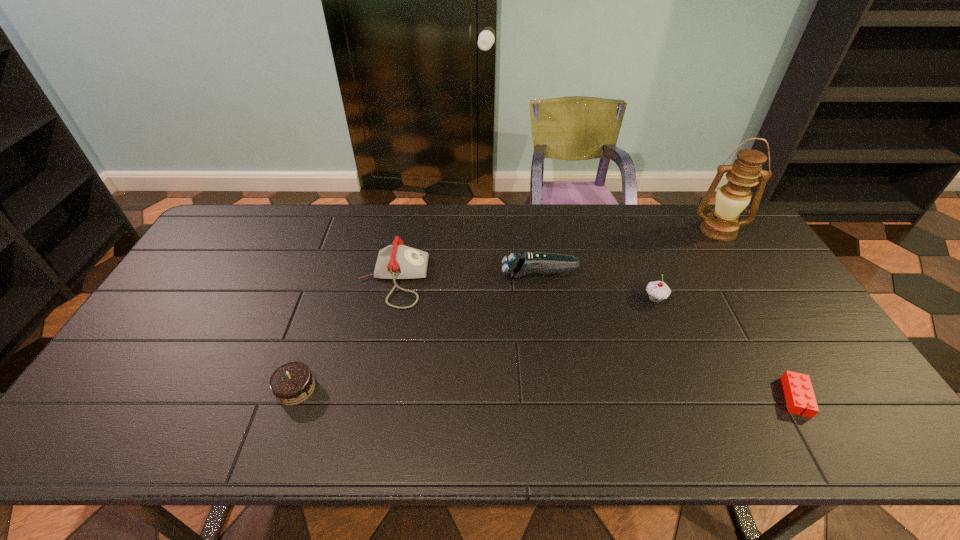
The image size is (960, 540). Identify the location of object that is at the far right corner. (731, 199).

At what (x,y) coordinates should I click in order to perform the action: click on object that is at the near right corner. Please return your answer as a coordinate pair (x, y). This screenshot has width=960, height=540. Looking at the image, I should click on (798, 390).

Where is `free spot at the far edge of the desktop`? Image resolution: width=960 pixels, height=540 pixels. free spot at the far edge of the desktop is located at coordinates 317,208.

In the image, there is a desktop. At what (x,y) coordinates should I click in order to perform the action: click on vacant space at the near edge. Please return your answer as a coordinate pair (x, y). This screenshot has width=960, height=540. Looking at the image, I should click on (736, 440).

In order to click on free region at the left edge in this screenshot , I will do `click(157, 409)`.

In the image, there is a desktop. Identify the location of vacant area at the right edge. The width and height of the screenshot is (960, 540). (789, 291).

Locate an element on the screen. This screenshot has height=540, width=960. free space at the far left corner is located at coordinates (238, 235).

The height and width of the screenshot is (540, 960). Identify the location of vacant space that's between the cupcake and the chocolate cake. (475, 344).

The height and width of the screenshot is (540, 960). I want to click on empty location between the farthest object and the fourth object from left to right, so click(686, 265).

Locate an element on the screen. This screenshot has width=960, height=540. free spot between the shortest object and the fifth object from right to left is located at coordinates (594, 339).